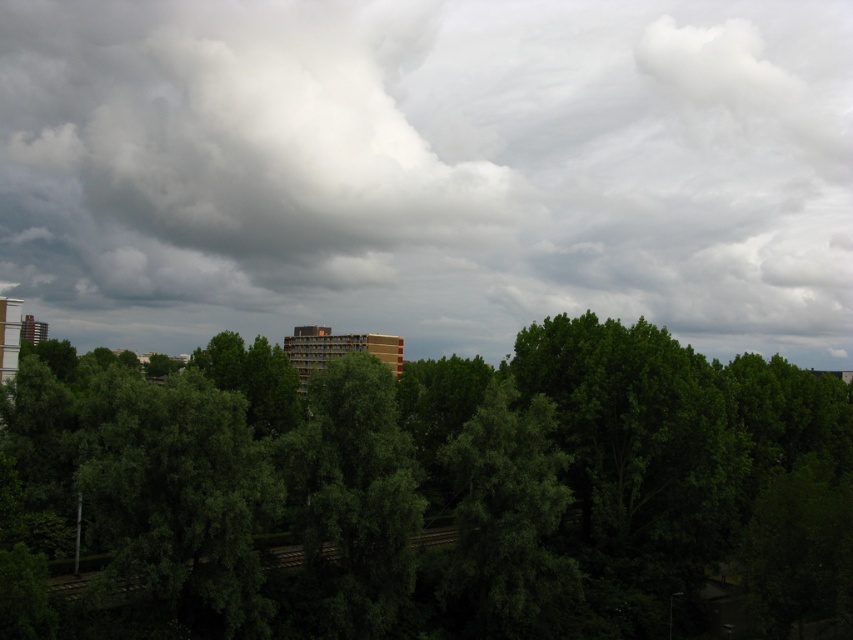
Question: Does white fluffy cloud at upper center appear over green leafy tree at center?

Choices:
 (A) yes
 (B) no

Answer: (A)

Question: Which object is farther from the camera taking this photo?

Choices:
 (A) white fluffy cloud at upper center
 (B) green leafy tree at center

Answer: (A)

Question: Which object is closer to the camera taking this photo?

Choices:
 (A) green leafy tree at center
 (B) white fluffy cloud at upper center

Answer: (A)

Question: Is white fluffy cloud at upper center to the right of green leafy tree at center from the viewer's perspective?

Choices:
 (A) yes
 (B) no

Answer: (A)

Question: Can you confirm if white fluffy cloud at upper center is bigger than green leafy tree at center?

Choices:
 (A) yes
 (B) no

Answer: (A)

Question: Which point is farther to the camera?

Choices:
 (A) (138, 308)
 (B) (154, 545)

Answer: (A)